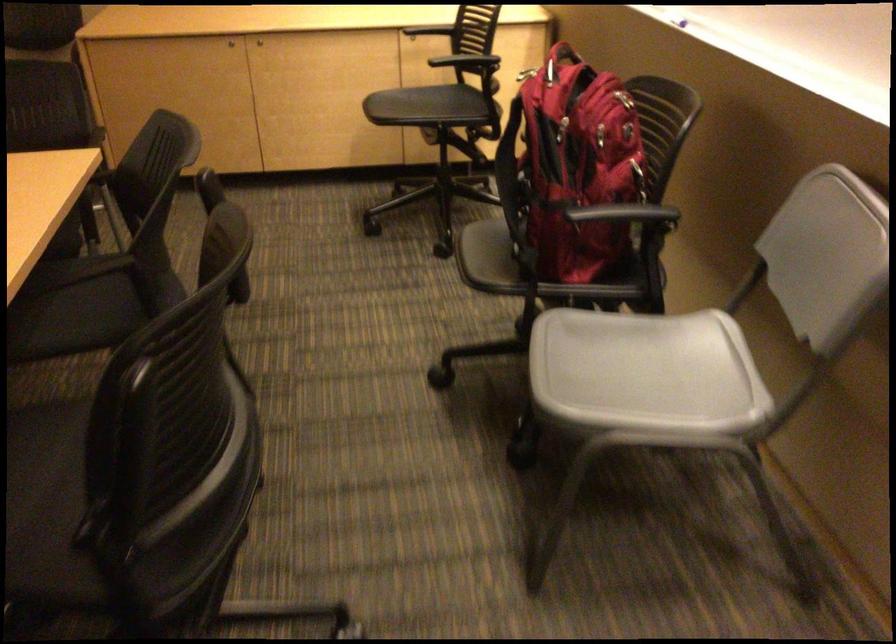
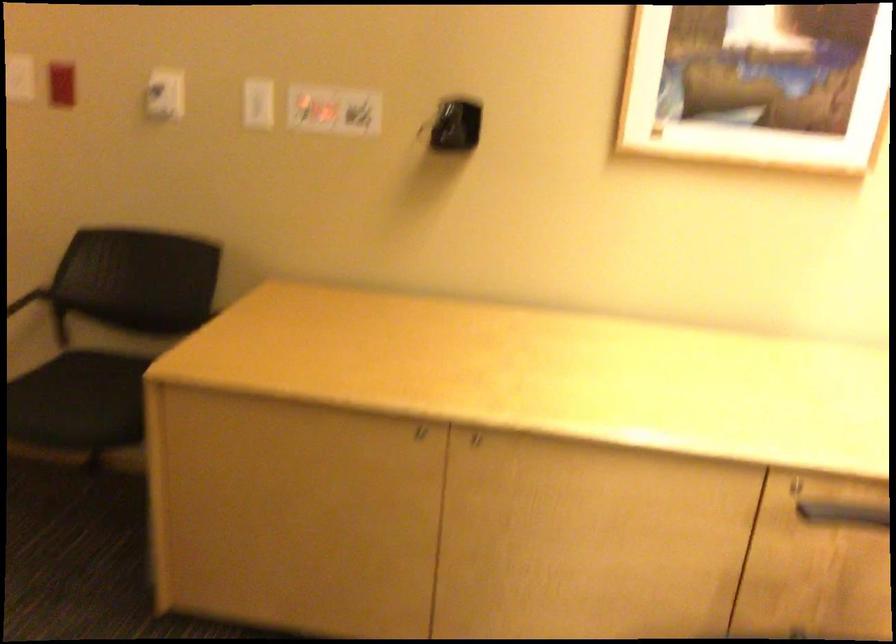
Question: Which direction would the cameraman need to move to produce the second image? Reply with the corresponding letter.

Choices:
 (A) Left
 (B) Right
 (C) Forward
 (D) Backward

Answer: (C)